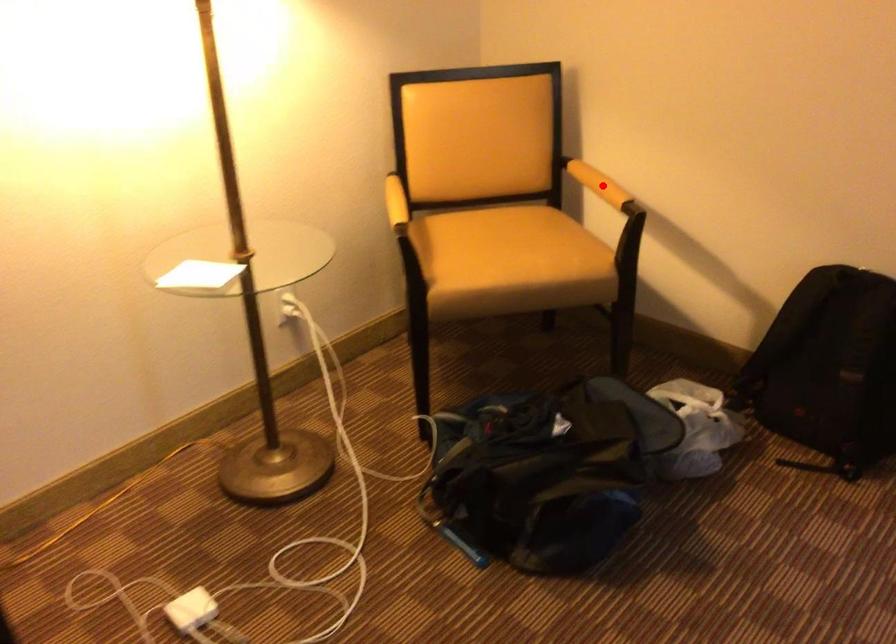
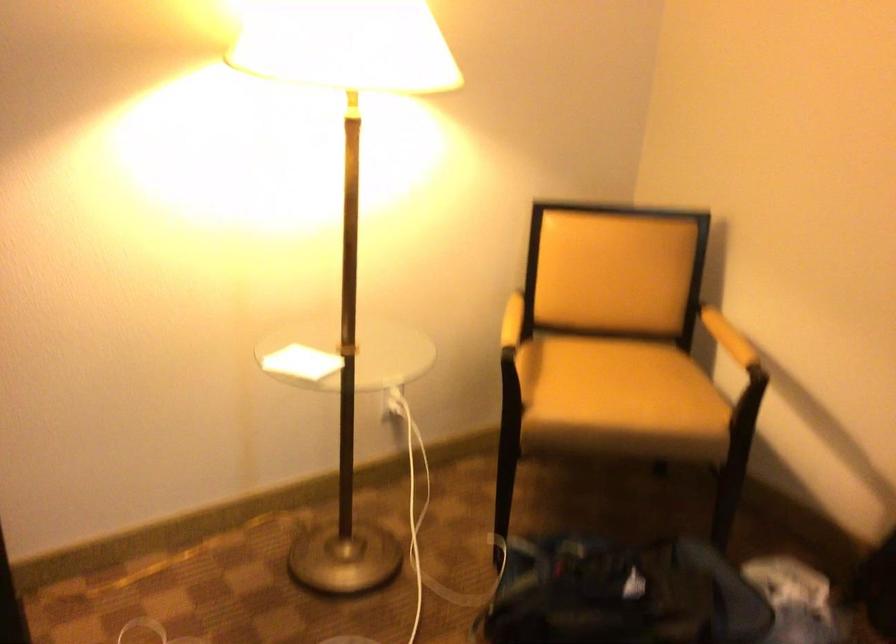
In the second image, find the point that corresponds to the highlighted location in the first image.

(728, 337)